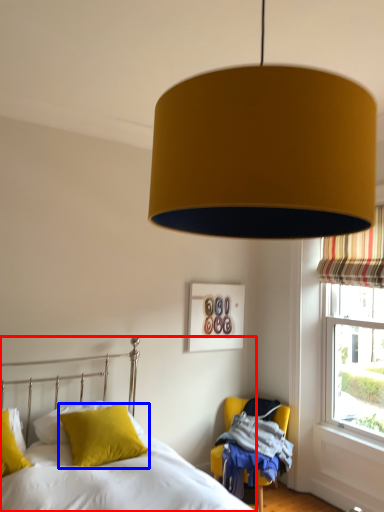
Question: Which object appears farthest to the camera in this image, bed (highlighted by a red box) or pillow (highlighted by a blue box)?

Choices:
 (A) bed
 (B) pillow

Answer: (B)